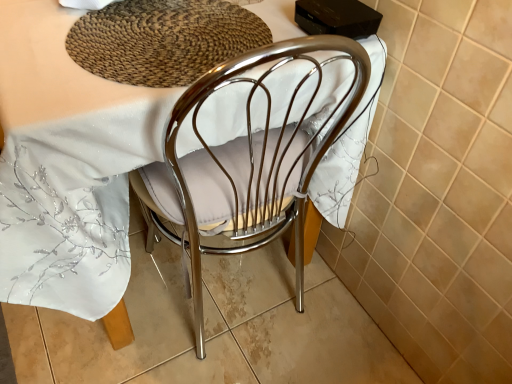
Question: Based on their sizes in the image, would you say polished chrome chair at center is bigger or smaller than woven brown mat at upper center?

Choices:
 (A) big
 (B) small

Answer: (A)

Question: Is point (196, 327) positioned closer to the camera than point (95, 11)?

Choices:
 (A) farther
 (B) closer

Answer: (A)

Question: Would you say polished chrome chair at center is to the left or to the right of woven brown mat at upper center in the picture?

Choices:
 (A) right
 (B) left

Answer: (B)

Question: Is woven brown mat at upper center situated inside polished chrome chair at center or outside?

Choices:
 (A) outside
 (B) inside

Answer: (B)

Question: Is woven brown mat at upper center wider or thinner than polished chrome chair at center?

Choices:
 (A) thin
 (B) wide

Answer: (A)

Question: Is woven brown mat at upper center taller or shorter than polished chrome chair at center?

Choices:
 (A) tall
 (B) short

Answer: (B)

Question: Is woven brown mat at upper center bigger or smaller than polished chrome chair at center?

Choices:
 (A) small
 (B) big

Answer: (A)